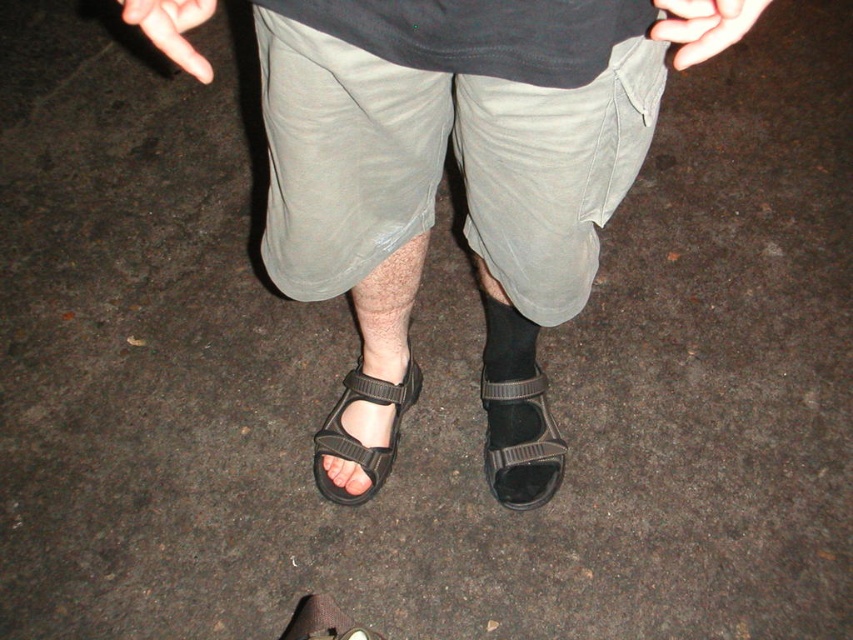
Is flesh-toned skin at lower left positioned before black fabric sandal at lower center?

Yes, flesh-toned skin at lower left is in front of black fabric sandal at lower center.

Can you confirm if flesh-toned skin at lower left is positioned above black fabric sandal at lower center?

Yes, flesh-toned skin at lower left is above black fabric sandal at lower center.

This screenshot has height=640, width=853. I want to click on flesh-toned skin at lower left, so click(x=172, y=29).

Can you confirm if black rubber sandal at lower center is positioned above matte black toe at center?

Indeed, black rubber sandal at lower center is positioned over matte black toe at center.

Is point (500, 484) in front of point (363, 488)?

That is True.

The width and height of the screenshot is (853, 640). Describe the element at coordinates (520, 442) in the screenshot. I see `black rubber sandal at lower center` at that location.

Find the location of `black rubber sandal at lower center`. black rubber sandal at lower center is located at coordinates (520, 442).

Is black synthetic sandal at lower left taller than smooth skin hand at upper right?

Correct, black synthetic sandal at lower left is much taller as smooth skin hand at upper right.

Consider the image. Between black synthetic sandal at lower left and smooth skin hand at upper right, which one is positioned lower?

black synthetic sandal at lower left is below.

This screenshot has width=853, height=640. In order to click on black synthetic sandal at lower left in this screenshot , I will do `click(357, 438)`.

Locate an element on the screen. This screenshot has height=640, width=853. black synthetic sandal at lower left is located at coordinates (357, 438).